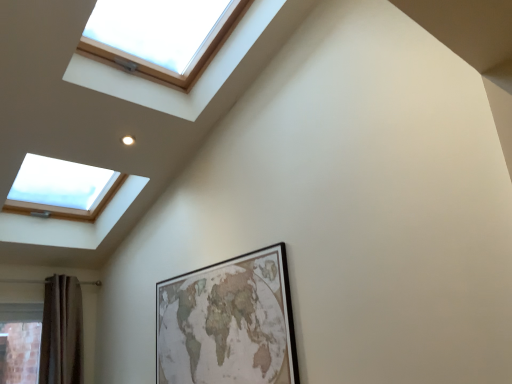
In order to face brown textured curtain at lower left, should I rotate leftwards or rightwards?

It's best to rotate left around 24.041 degrees.

Identify the location of brown textured curtain at lower left. (62, 332).

Where is `wooden frame skylight at upper left`? The image size is (512, 384). wooden frame skylight at upper left is located at coordinates (160, 35).

From a real-world perspective, who is located lower, wooden framed map at center or brown textured curtain at lower left?

wooden framed map at center, from a real-world perspective.

Locate an element on the screen. shower curtain that appears below the wooden framed map at center (from the image's perspective) is located at coordinates (62, 332).

Is wooden framed map at center oriented towards brown textured curtain at lower left?

No, wooden framed map at center does not turn towards brown textured curtain at lower left.

From the image's perspective, is wooden frame skylight at upper left located above or below wooden framed map at center?

Based on their image positions, wooden frame skylight at upper left is located above wooden framed map at center.

Would you consider wooden frame skylight at upper left to be distant from wooden framed map at center?

wooden frame skylight at upper left is far away from wooden framed map at center.

Between wooden frame skylight at upper left and wooden framed map at center, which one appears on the right side from the viewer's perspective?

wooden framed map at center.

From a real-world perspective, is brown textured curtain at lower left above or below wooden frame skylight at upper left?

In terms of real-world spatial position, brown textured curtain at lower left is below wooden frame skylight at upper left.

From the image's perspective, is brown textured curtain at lower left under wooden frame skylight at upper left?

Yes, from the image's perspective, brown textured curtain at lower left is below wooden frame skylight at upper left.

Can you tell me how much brown textured curtain at lower left and wooden frame skylight at upper left differ in facing direction?

They differ by 0.45 degrees in their facing directions.

Consider the image. Is brown textured curtain at lower left not inside wooden frame skylight at upper left?

Yes.

Can you confirm if brown textured curtain at lower left is shorter than wooden framed map at center?

No, brown textured curtain at lower left is not shorter than wooden framed map at center.

In the image, is brown textured curtain at lower left positioned in front of or behind wooden framed map at center?

In the image, brown textured curtain at lower left appears behind wooden framed map at center.

Looking at this image, would you say brown textured curtain at lower left is a long distance from wooden framed map at center?

Absolutely, brown textured curtain at lower left is distant from wooden framed map at center.

From a real-world perspective, which is physically below, wooden framed map at center or wooden frame skylight at upper left?

wooden framed map at center, from a real-world perspective.

Considering the relative sizes of wooden framed map at center and wooden frame skylight at upper left in the image provided, is wooden framed map at center taller than wooden frame skylight at upper left?

Incorrect, the height of wooden framed map at center is not larger of that of wooden frame skylight at upper left.

Which object is wider, wooden framed map at center or wooden frame skylight at upper left?

Wider between the two is wooden frame skylight at upper left.

Where is `window on the left of wooden framed map at center`? window on the left of wooden framed map at center is located at coordinates (160, 35).

Looking at this image, from the image's perspective, which is below, wooden frame skylight at upper left or brown textured curtain at lower left?

brown textured curtain at lower left.

Is wooden frame skylight at upper left with brown textured curtain at lower left?

There is a gap between wooden frame skylight at upper left and brown textured curtain at lower left.

In terms of width, does wooden frame skylight at upper left look wider or thinner when compared to brown textured curtain at lower left?

wooden frame skylight at upper left is wider than brown textured curtain at lower left.

At what (x,y) coordinates should I click in order to perform the action: click on picture frame on the right side of brown textured curtain at lower left. Please return your answer as a coordinate pair (x, y). Image resolution: width=512 pixels, height=384 pixels. Looking at the image, I should click on (228, 323).

The height and width of the screenshot is (384, 512). In order to click on window in front of the wooden framed map at center in this screenshot , I will do `click(160, 35)`.

From the picture: Looking at the image, which one is located further to brown textured curtain at lower left, wooden frame skylight at upper left or wooden framed map at center?

The object further to brown textured curtain at lower left is wooden frame skylight at upper left.

Estimate the real-world distances between objects in this image. Which object is further from brown textured curtain at lower left, wooden framed map at center or wooden frame skylight at upper left?

Based on the image, wooden frame skylight at upper left appears to be further to brown textured curtain at lower left.

Looking at the image, which one is located further to wooden frame skylight at upper left, brown textured curtain at lower left or wooden framed map at center?

Among the two, brown textured curtain at lower left is located further to wooden frame skylight at upper left.

Which object lies further to the anchor point wooden frame skylight at upper left, wooden framed map at center or brown textured curtain at lower left?

brown textured curtain at lower left is positioned further to the anchor wooden frame skylight at upper left.

Estimate the real-world distances between objects in this image. Which object is further from wooden framed map at center, brown textured curtain at lower left or wooden frame skylight at upper left?

Among the two, brown textured curtain at lower left is located further to wooden framed map at center.

Estimate the real-world distances between objects in this image. Which object is further from wooden framed map at center, wooden frame skylight at upper left or brown textured curtain at lower left?

brown textured curtain at lower left is positioned further to the anchor wooden framed map at center.

This screenshot has height=384, width=512. In order to click on picture frame that lies between wooden frame skylight at upper left and brown textured curtain at lower left from top to bottom in this screenshot , I will do `click(228, 323)`.